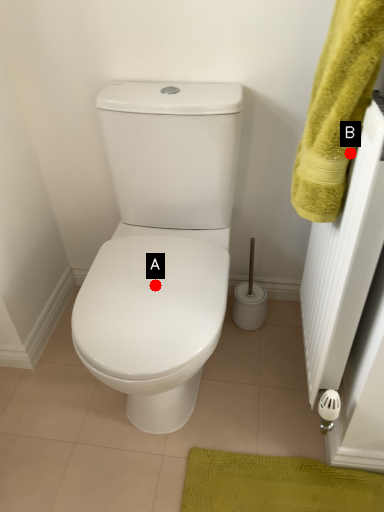
Question: Two points are circled on the image, labeled by A and B beside each circle. Which point is closer to the camera?

Choices:
 (A) A is closer
 (B) B is closer

Answer: (B)